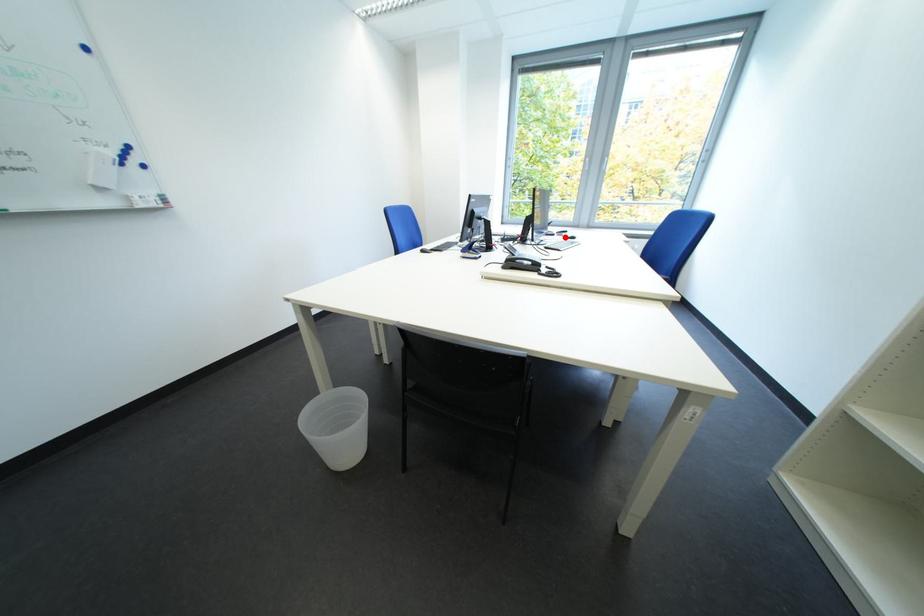
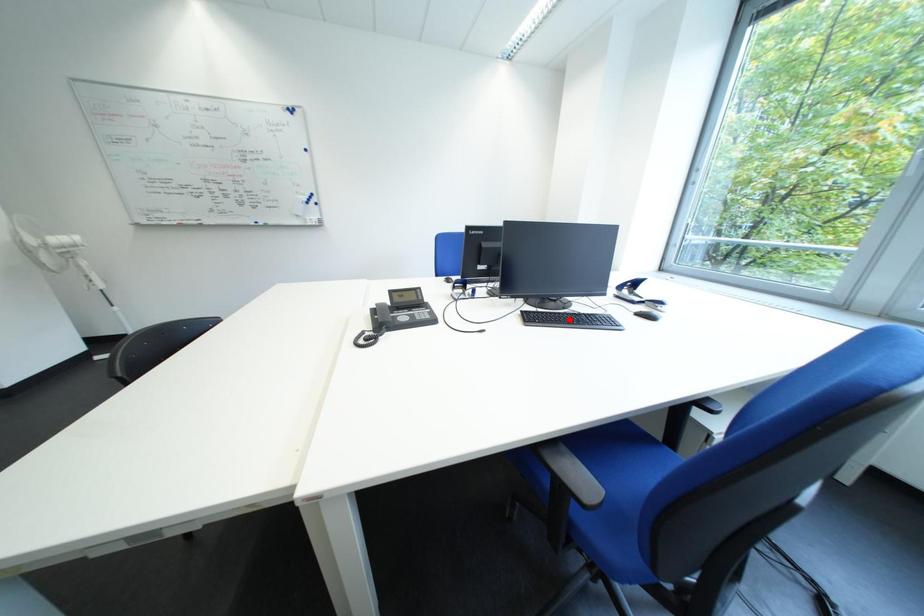
I am providing you with two images of the same scene from different viewpoints. A red point is marked on the first image and another point is marked on the second image. Are the points marked in image1 and image2 representing the same 3D position?

No